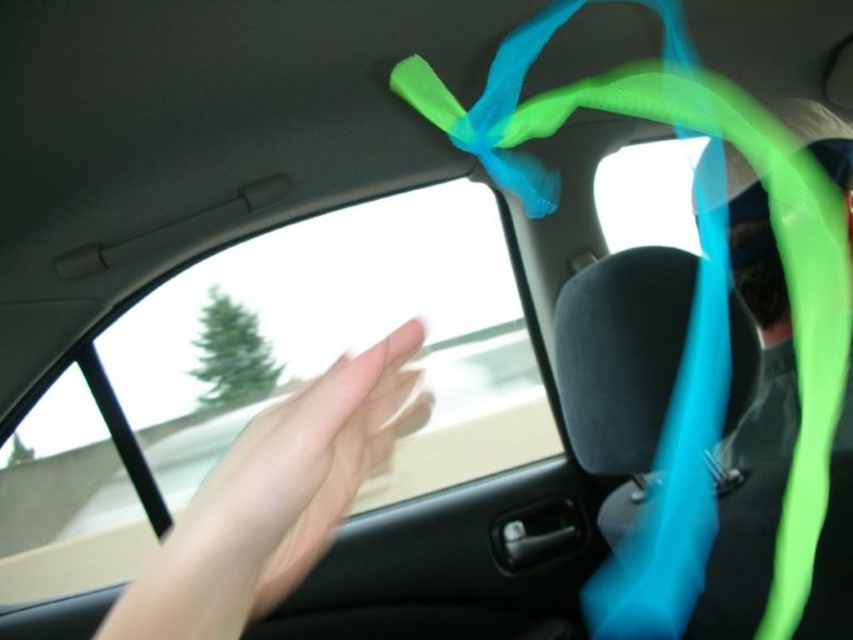
Is transparent glass car window at center behind pale skin hand at center?

Yes, it is.

Which is more to the left, transparent glass car window at center or pale skin hand at center?

transparent glass car window at center is more to the left.

Where is `transparent glass car window at center`? Image resolution: width=853 pixels, height=640 pixels. transparent glass car window at center is located at coordinates (343, 339).